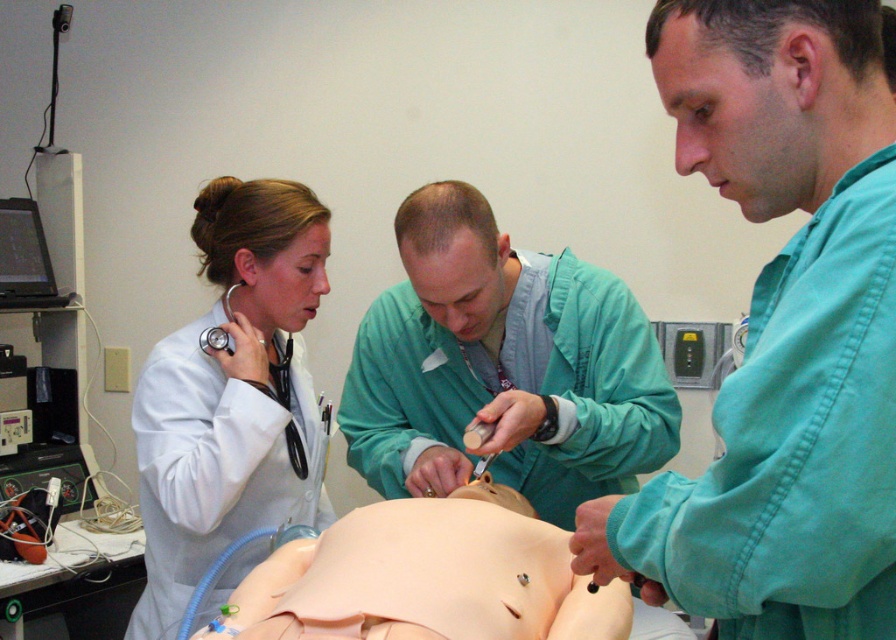
You are a medical student observing the simulation. You need to quickly grab the matte black stethoscope at left to check the mannequin. Can you reach it without moving the white matte coat at left?

The white matte coat at left is positioned on the left side of the matte black stethoscope at left, so you can reach the stethoscope without moving the coat.

You are a medical student observing the scene. You need to determine which object is bigger between the white matte coat at left and the matte black stethoscope at left. Which one is larger?

The white matte coat at left is larger in size than the matte black stethoscope at left.